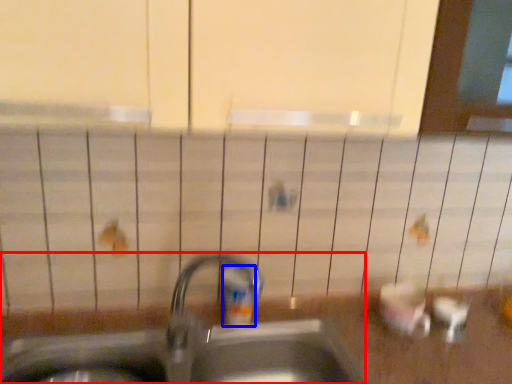
Question: Among these objects, which one is nearest to the camera, sink (highlighted by a red box) or toiletry (highlighted by a blue box)?

Choices:
 (A) sink
 (B) toiletry

Answer: (A)